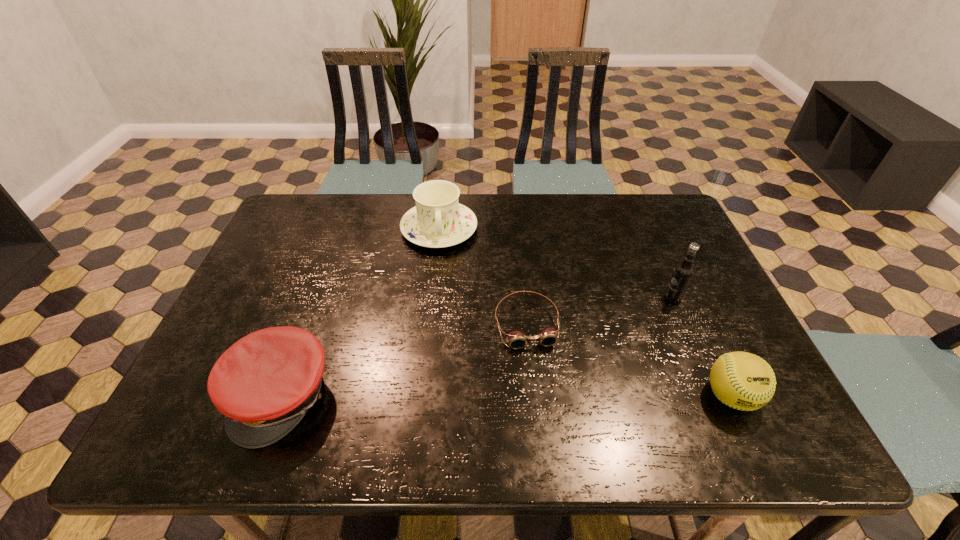
Identify the location of vacant spot on the desktop that is between the leftmost object and the softball and is positioned on the handle side of the chinaware. (453, 396).

Where is `vacant spot on the desktop that is between the cap and the softball and is positioned through the lenses of the shortest object`? vacant spot on the desktop that is between the cap and the softball and is positioned through the lenses of the shortest object is located at coordinates click(x=543, y=396).

Find the location of a particular element. This screenshot has width=960, height=540. vacant spot on the desktop that is between the cap and the softball and is positioned on the label of the root beer is located at coordinates point(491,396).